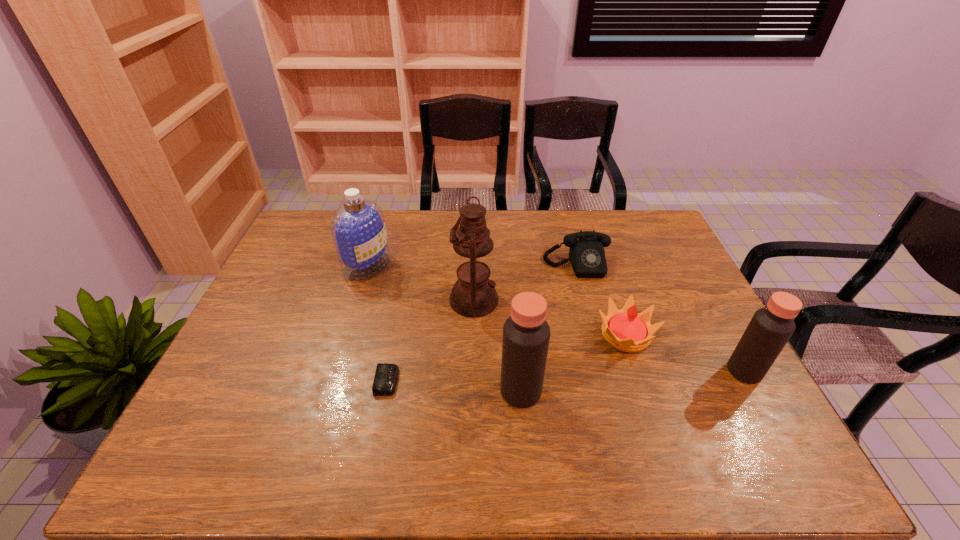
Find the location of `the left vinegar`. the left vinegar is located at coordinates [526, 334].

Find the location of a particular element. the rightmost object is located at coordinates (770, 328).

This screenshot has width=960, height=540. In order to click on the right vinegar in this screenshot , I will do `click(770, 328)`.

Locate an element on the screen. Image resolution: width=960 pixels, height=540 pixels. the second shortest object is located at coordinates (586, 253).

You are a GUI agent. You are given a task and a screenshot of the screen. Output one action in this format:
    pyautogui.click(x=<x>, y=<y>)
    Task: Click on the leftmost object
    This screenshot has height=540, width=960.
    Given the screenshot: What is the action you would take?
    pyautogui.click(x=358, y=229)

You are a GUI agent. You are given a task and a screenshot of the screen. Output one action in this format:
    pyautogui.click(x=<x>, y=<y>)
    Task: Click on the oil lamp
    The width and height of the screenshot is (960, 540).
    Given the screenshot: What is the action you would take?
    pyautogui.click(x=473, y=295)

Locate an element on the screen. This screenshot has width=960, height=540. the third shortest object is located at coordinates (626, 330).

Locate an element on the screen. This screenshot has width=960, height=540. the shortest object is located at coordinates (386, 375).

Where is `the second object from left to right`? the second object from left to right is located at coordinates (386, 375).

Locate an element on the screen. free space located 0.110m on the left of the left vinegar is located at coordinates (455, 391).